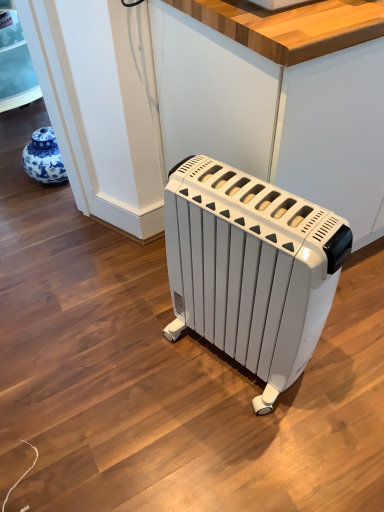
Identify the location of free space to the right of white plastic radiator at center. This screenshot has height=512, width=384. (345, 362).